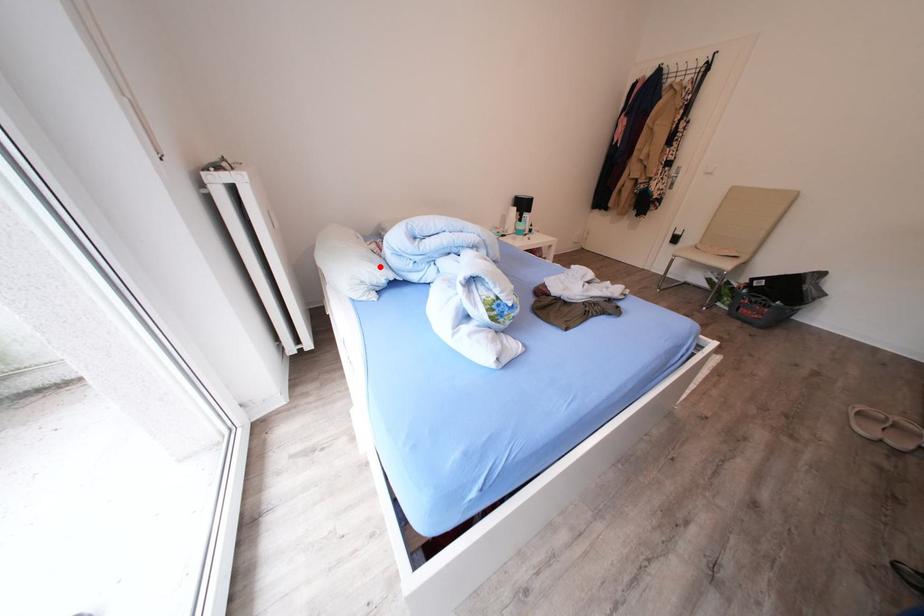
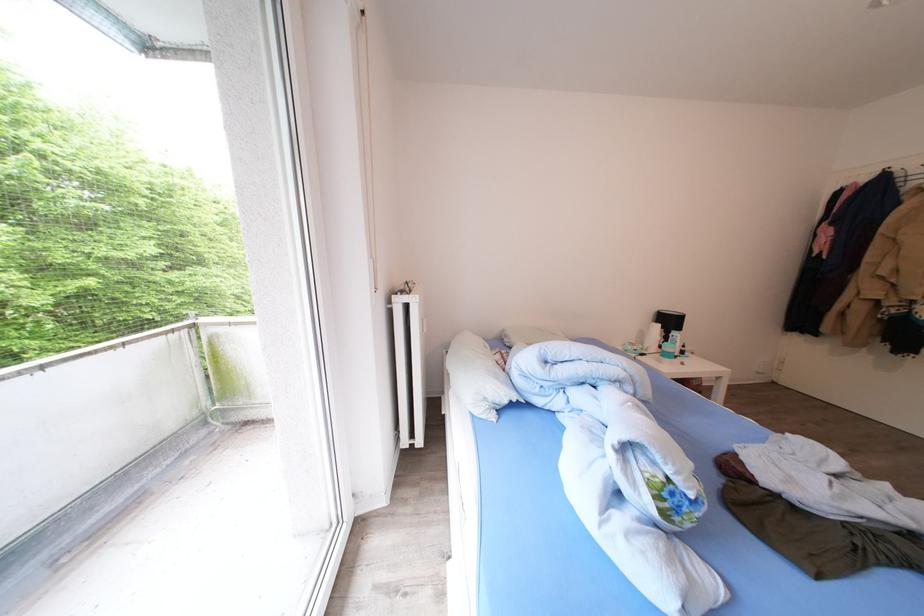
Question: I am providing you with two images of the same scene from different viewpoints. In image1, a red point is highlighted. Considering the same 3D point in image2, which of the following is correct?

Choices:
 (A) It is closer
 (B) It is farther

Answer: (B)